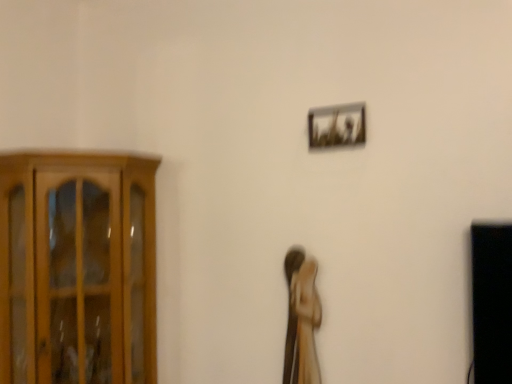
Question: In terms of width, does metallic silver frame at upper right look wider or thinner when compared to wooden cabinet at left?

Choices:
 (A) thin
 (B) wide

Answer: (A)

Question: From their relative heights in the image, would you say metallic silver frame at upper right is taller or shorter than wooden cabinet at left?

Choices:
 (A) short
 (B) tall

Answer: (A)

Question: Which object is positioned farthest from the wooden statue at center?

Choices:
 (A) metallic silver frame at upper right
 (B) wooden cabinet at left

Answer: (B)

Question: Estimate the real-world distances between objects in this image. Which object is closer to the wooden statue at center?

Choices:
 (A) wooden cabinet at left
 (B) metallic silver frame at upper right

Answer: (B)